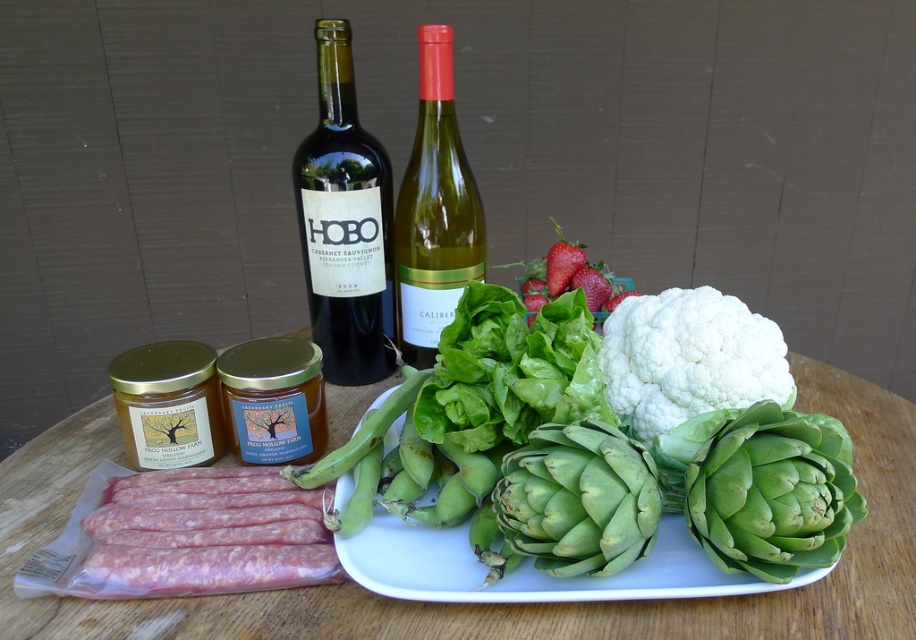
You are setting up a picnic and have a green leafy artichoke at center and green matte artichokes at center. Which one is placed on top of the other?

The green leafy artichoke at center is positioned over green matte artichokes at center.